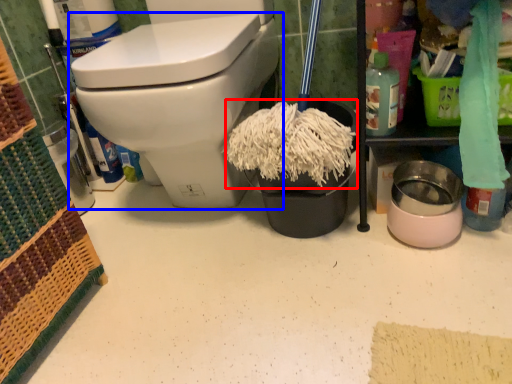
Question: Which object appears farthest to the camera in this image, debris (highlighted by a red box) or toilet (highlighted by a blue box)?

Choices:
 (A) debris
 (B) toilet

Answer: (A)